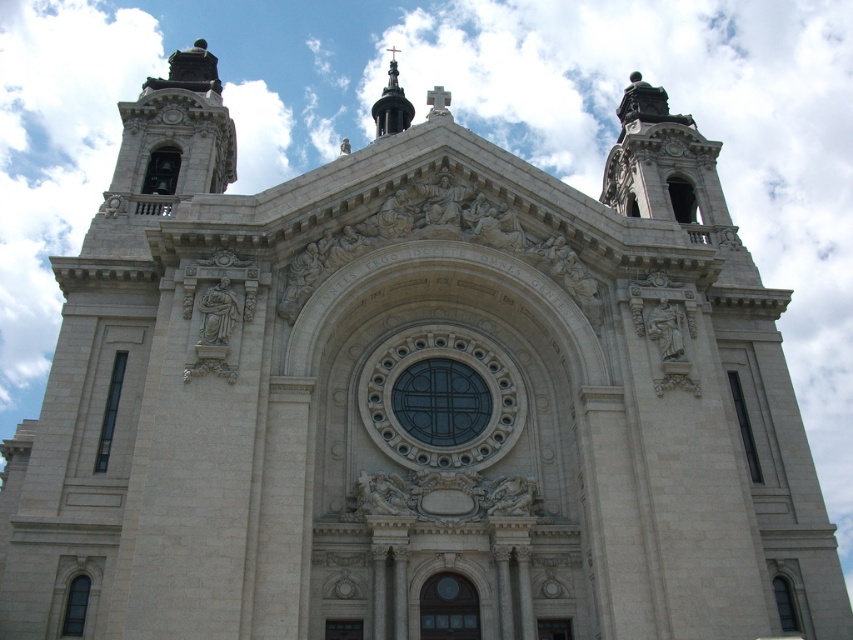
Between shiny black spire at upper center and white stone clock at upper center, which one has more height?

Standing taller between the two is shiny black spire at upper center.

Is shiny black spire at upper center thinner than white stone clock at upper center?

Incorrect, shiny black spire at upper center's width is not less than white stone clock at upper center's.

Does point (380, 109) lie in front of point (177, 122)?

No.

I want to click on shiny black spire at upper center, so click(392, 104).